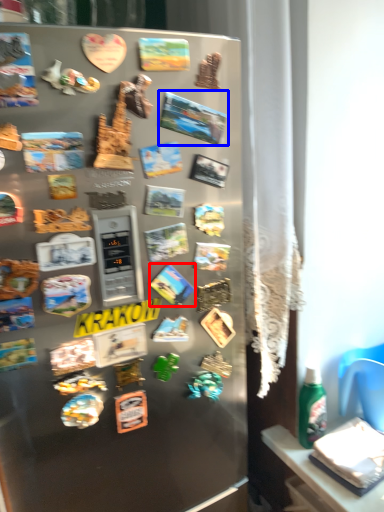
Question: Which of the following is the closest to the observer, comic book (highlighted by a red box) or comic book (highlighted by a blue box)?

Choices:
 (A) comic book
 (B) comic book

Answer: (B)